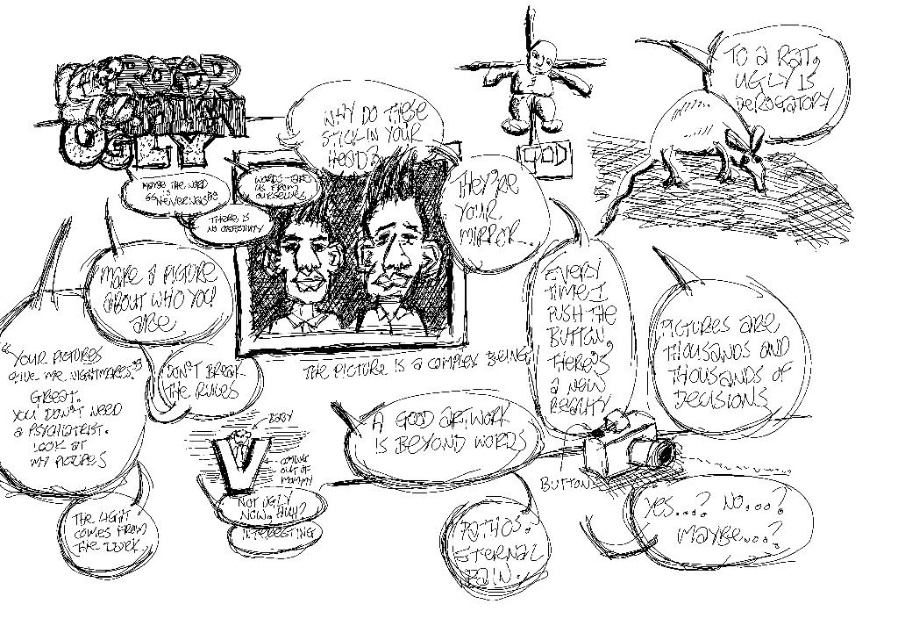
Does point (439, 321) come in front of point (333, 323)?

No, (439, 321) is behind (333, 323).

Between grayscale sketch portrait at center and smooth black face at center, which one has less height?

With less height is smooth black face at center.

Describe the element at coordinates (395, 244) in the screenshot. I see `grayscale sketch portrait at center` at that location.

You are a GUI agent. You are given a task and a screenshot of the screen. Output one action in this format:
    pyautogui.click(x=<x>, y=<y>)
    Task: Click on the grayscale sketch portrait at center
    
    Given the screenshot: What is the action you would take?
    pyautogui.click(x=395, y=244)